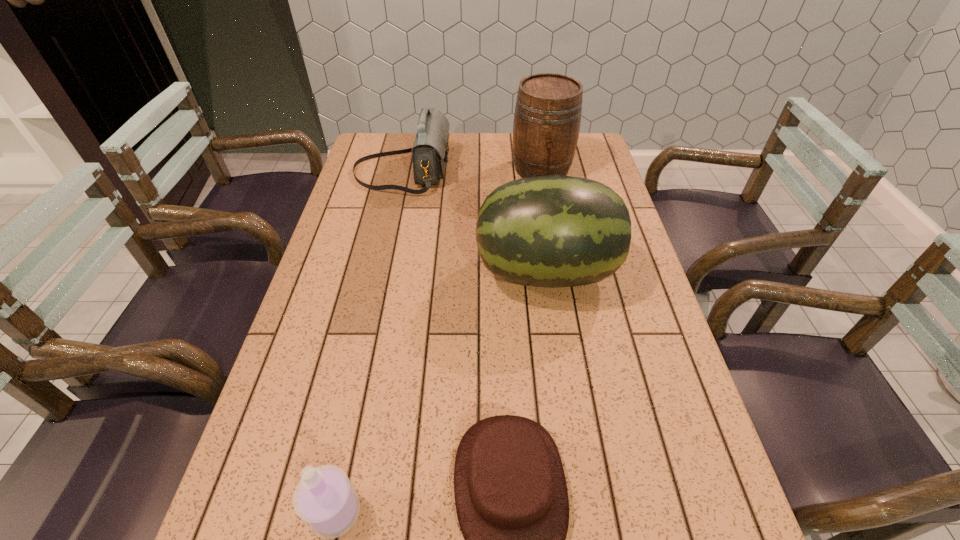
This screenshot has height=540, width=960. What are the coordinates of `cider` in the screenshot? It's located at (547, 118).

The image size is (960, 540). Find the location of `the third farthest object`. the third farthest object is located at coordinates (553, 231).

The width and height of the screenshot is (960, 540). I want to click on shoulder bag, so click(430, 150).

The width and height of the screenshot is (960, 540). I want to click on vacant space located on the side of the cider near the bung hole, so click(556, 250).

The width and height of the screenshot is (960, 540). In order to click on vacant space located on the left of the third farthest object in this screenshot , I will do `click(411, 272)`.

At what (x,y) coordinates should I click in order to perform the action: click on free space located on the back of the shoulder bag. Please return your answer as a coordinate pair (x, y). The width and height of the screenshot is (960, 540). Looking at the image, I should click on (410, 139).

Where is `cider at the far edge`? cider at the far edge is located at coordinates (547, 118).

Where is `shoulder bag at the far edge`? The image size is (960, 540). shoulder bag at the far edge is located at coordinates (430, 150).

At what (x,y) coordinates should I click in order to perform the action: click on object situated at the left edge. Please return your answer as a coordinate pair (x, y). Looking at the image, I should click on (430, 150).

Identify the location of cider located in the right edge section of the desktop. Image resolution: width=960 pixels, height=540 pixels. (547, 118).